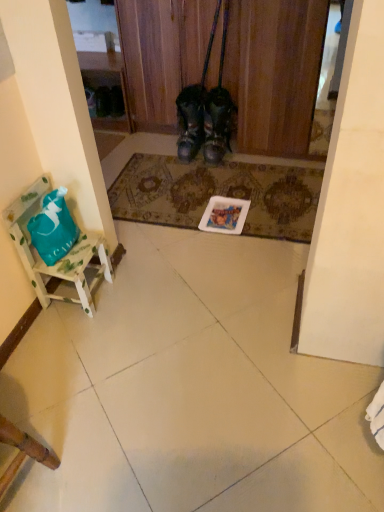
What do you see at coordinates (218, 194) in the screenshot?
I see `patterned carpet at center` at bounding box center [218, 194].

Locate an element on the screen. patterned carpet at center is located at coordinates (218, 194).

Where is `wooden chair at lower left`? The height and width of the screenshot is (512, 384). wooden chair at lower left is located at coordinates (22, 452).

Describe the element at coordinates (275, 72) in the screenshot. I see `black leather boots at center` at that location.

The height and width of the screenshot is (512, 384). Describe the element at coordinates (60, 259) in the screenshot. I see `white wood chair at left` at that location.

This screenshot has width=384, height=512. I want to click on leather boots at center, the first footwear in the right-to-left sequence, so click(204, 121).

Is black leather boots at center turned away from leather boots at center, the second footwear viewed from the right?

No, black leather boots at center's orientation is not away from leather boots at center, the second footwear viewed from the right.

Is point (298, 93) behind point (178, 110)?

No, (298, 93) is in front of (178, 110).

Which object is wider, black leather boots at center or leather boots at center, the second footwear viewed from the right?

With larger width is black leather boots at center.

Is black leather boots at center in front of or behind leather boots at center, the first footwear viewed from the left, in the image?

In the image, black leather boots at center appears in front of leather boots at center, the first footwear viewed from the left.

Is black leather boots at center next to patterned carpet at center and touching it?

No, black leather boots at center is not with patterned carpet at center.

Does black leather boots at center appear on the left side of patterned carpet at center?

Yes.

Between point (243, 115) and point (190, 188), which one is positioned in front?

Point (190, 188)

Between point (52, 469) and point (270, 196), which one is positioned in front?

Point (52, 469)

Measure the distance from wooden chair at lower left to patterned carpet at center.

wooden chair at lower left and patterned carpet at center are 1.45 meters apart.

Based on the photo, is wooden chair at lower left taller than patterned carpet at center?

Correct, wooden chair at lower left is much taller as patterned carpet at center.

Does wooden chair at lower left have a greater width compared to patterned carpet at center?

No, wooden chair at lower left is not wider than patterned carpet at center.

Can you see black leather boots at center touching white wood chair at left?

No, black leather boots at center is not in contact with white wood chair at left.

From the image's perspective, is black leather boots at center positioned above or below white wood chair at left?

Based on their image positions, black leather boots at center is located above white wood chair at left.

Is white wood chair at left located within black leather boots at center?

No, white wood chair at left is not a part of black leather boots at center.

From a real-world perspective, which is physically above, leather boots at center, the first footwear viewed from the left, or wooden chair at lower left?

In real-world perspective, wooden chair at lower left is above.

Can you confirm if leather boots at center, the first footwear viewed from the left, is bigger than wooden chair at lower left?

Actually, leather boots at center, the first footwear viewed from the left, might be smaller than wooden chair at lower left.

Considering the relative positions of leather boots at center, the second footwear viewed from the right, and wooden chair at lower left in the image provided, is leather boots at center, the second footwear viewed from the right, behind wooden chair at lower left?

Yes, leather boots at center, the second footwear viewed from the right, is behind wooden chair at lower left.

Is leather boots at center, the second footwear viewed from the right, spatially inside wooden chair at lower left, or outside of it?

leather boots at center, the second footwear viewed from the right, is located beyond the bounds of wooden chair at lower left.

Is the surface of white wood chair at left in direct contact with leather boots at center, the first footwear in the right-to-left sequence?

No, white wood chair at left is not touching leather boots at center, the first footwear in the right-to-left sequence.

Is white wood chair at left wider or thinner than leather boots at center, which is the second footwear from left to right?

white wood chair at left is thinner than leather boots at center, which is the second footwear from left to right.

Locate an element on the screen. the 2nd footwear to the right when counting from the white wood chair at left is located at coordinates (204, 121).

From the image's perspective, does white wood chair at left appear lower than leather boots at center, the first footwear in the right-to-left sequence?

Yes, from the image's perspective, white wood chair at left is below leather boots at center, the first footwear in the right-to-left sequence.

Which object is positioned more to the right, patterned carpet at center or white wood chair at left?

From the viewer's perspective, patterned carpet at center appears more on the right side.

Can you confirm if patterned carpet at center is thinner than white wood chair at left?

No, patterned carpet at center is not thinner than white wood chair at left.

Considering the sizes of patterned carpet at center and white wood chair at left in the image, is patterned carpet at center taller or shorter than white wood chair at left?

Clearly, patterned carpet at center is shorter compared to white wood chair at left.

Is point (166, 211) closer to camera compared to point (54, 276)?

That is False.

You are a GUI agent. You are given a task and a screenshot of the screen. Output one action in this format:
    pyautogui.click(x=<x>, y=<y>)
    Task: Click on the footwear that is the 1st object located below the black leather boots at center (from the image's perspective)
    
    Given the screenshot: What is the action you would take?
    pyautogui.click(x=190, y=121)

Where is `door above the patterned carpet at center (from the image's perspective)`? The height and width of the screenshot is (512, 384). door above the patterned carpet at center (from the image's perspective) is located at coordinates (275, 72).

Which object lies further to the anchor point white wood chair at left, wooden chair at lower left or black leather boots at center?

The object further to white wood chair at left is black leather boots at center.

Based on their spatial positions, is black leather boots at center or leather boots at center, which is the second footwear from left to right, further from patterned carpet at center?

black leather boots at center lies further to patterned carpet at center than the other object.

When comparing their distances from leather boots at center, the first footwear in the right-to-left sequence, does black leather boots at center or white wood chair at left seem closer?

A: Among the two, black leather boots at center is located nearer to leather boots at center, the first footwear in the right-to-left sequence.

From the image, which object appears to be nearer to patterned carpet at center, wooden chair at lower left or black leather boots at center?

The object closer to patterned carpet at center is black leather boots at center.

From the image, which object appears to be farther from patterned carpet at center, wooden chair at lower left or white wood chair at left?

wooden chair at lower left is further to patterned carpet at center.

From the image, which object appears to be nearer to leather boots at center, which is the second footwear from left to right, patterned carpet at center or wooden chair at lower left?

The object closer to leather boots at center, which is the second footwear from left to right, is patterned carpet at center.

From the picture: When comparing their distances from white wood chair at left, does black leather boots at center or patterned carpet at center seem further?

black leather boots at center is further to white wood chair at left.

Considering their positions, is leather boots at center, which is the second footwear from left to right, positioned further to patterned carpet at center than black leather boots at center?

black leather boots at center is positioned further to the anchor patterned carpet at center.

You are a GUI agent. You are given a task and a screenshot of the screen. Output one action in this format:
    pyautogui.click(x=<x>, y=<y>)
    Task: Click on the furniture between black leather boots at center and wooden chair at lower left in the vertical direction
    This screenshot has width=384, height=512.
    Given the screenshot: What is the action you would take?
    pyautogui.click(x=60, y=259)

Locate an element on the screen. This screenshot has height=512, width=384. furniture between wooden chair at lower left and patterned carpet at center from front to back is located at coordinates (60, 259).

Identify the location of mat between white wood chair at left and leather boots at center, the first footwear in the right-to-left sequence, along the z-axis. The image size is (384, 512). (218, 194).

Find the location of a particular element. mat between wooden chair at lower left and leather boots at center, the second footwear viewed from the right, along the z-axis is located at coordinates (218, 194).